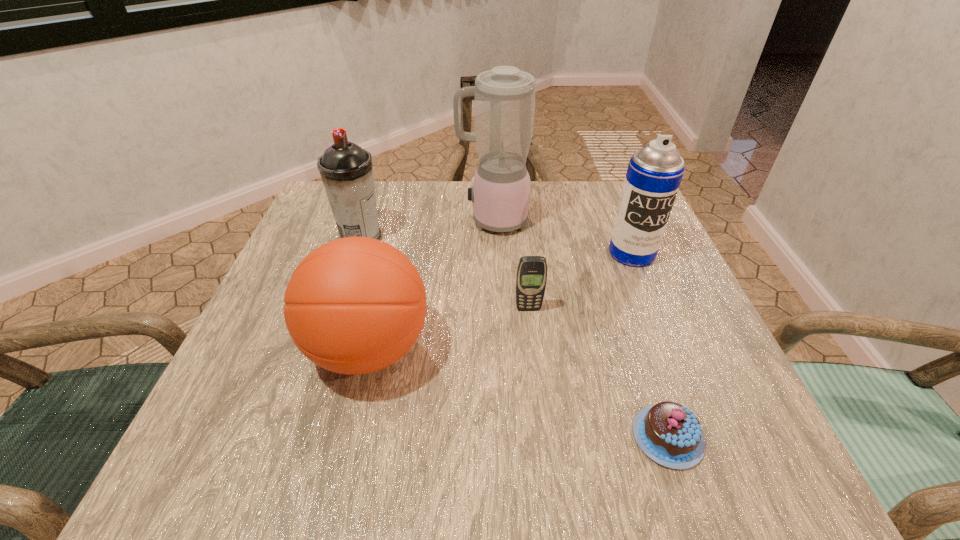
Identify the location of aerosol can positioned at the right edge. (654, 173).

Locate an element on the screen. The height and width of the screenshot is (540, 960). chocolate cake that is positioned at the right edge is located at coordinates (670, 434).

You are a GUI agent. You are given a task and a screenshot of the screen. Output one action in this format:
    pyautogui.click(x=<x>, y=<y>)
    Task: Click on the object located in the far left corner section of the desktop
    This screenshot has height=540, width=960.
    Given the screenshot: What is the action you would take?
    pyautogui.click(x=346, y=170)

Image resolution: width=960 pixels, height=540 pixels. I want to click on object present at the near right corner, so click(x=670, y=434).

This screenshot has width=960, height=540. I want to click on free space at the far edge of the desktop, so click(396, 215).

In the image, there is a desktop. At what (x,y) coordinates should I click in order to perform the action: click on vacant space at the near edge. Please return your answer as a coordinate pair (x, y). This screenshot has width=960, height=540. Looking at the image, I should click on (630, 465).

What are the coordinates of `vacant area at the left edge of the desktop` in the screenshot? It's located at pos(220,396).

This screenshot has width=960, height=540. In the image, there is a desktop. Find the location of `blank space at the right edge`. blank space at the right edge is located at coordinates (661, 264).

Image resolution: width=960 pixels, height=540 pixels. Find the location of `free space at the near left corner of the desktop`. free space at the near left corner of the desktop is located at coordinates (293, 429).

The height and width of the screenshot is (540, 960). Find the location of `vacant region at the far right corner of the desktop`. vacant region at the far right corner of the desktop is located at coordinates (611, 213).